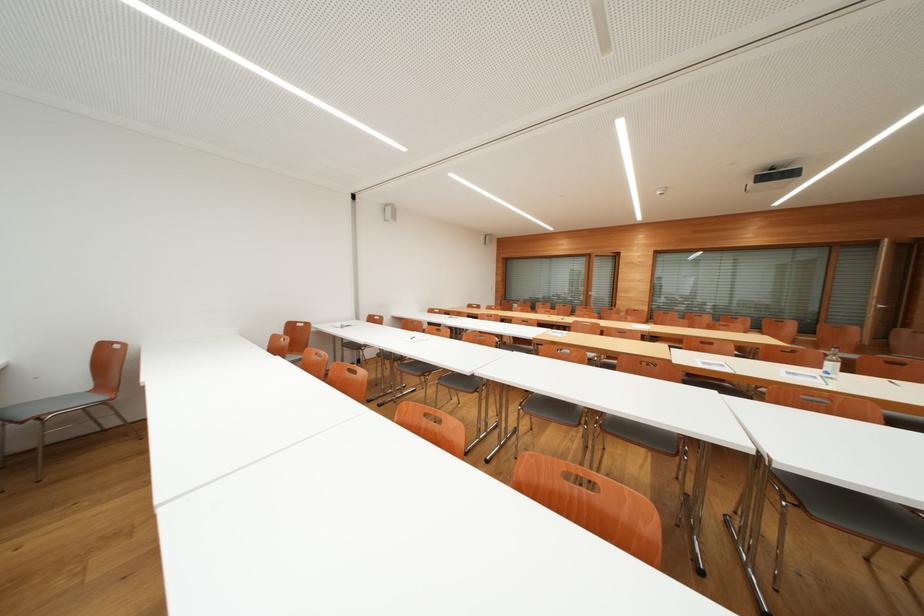
What do you see at coordinates (848, 371) in the screenshot? The image size is (924, 616). I see `a water bottle cap` at bounding box center [848, 371].